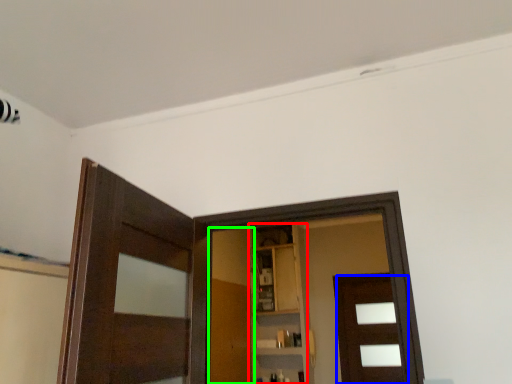
Question: Estimate the real-world distances between objects in this image. Which object is closer to cabinetry (highlighted by a red box), door (highlighted by a blue box) or barn door (highlighted by a green box)?

Choices:
 (A) door
 (B) barn door

Answer: (B)